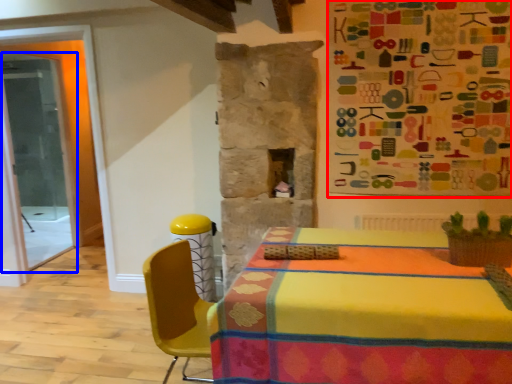
Question: Which point is closer to the camera, bulletin board (highlighted by a red box) or glass door (highlighted by a blue box)?

Choices:
 (A) bulletin board
 (B) glass door

Answer: (A)